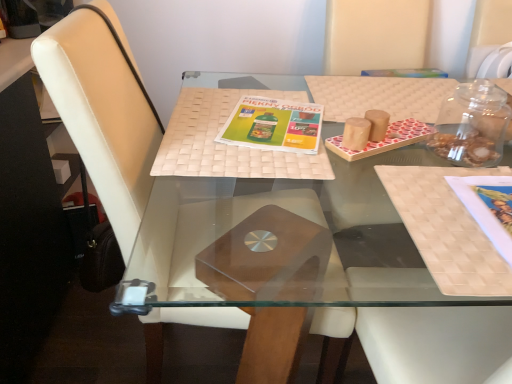
Question: Which direction should I rotate to face green matte magazine at center, arranged as the 2th book cover when ordered from the bottom, — up or down?

Choices:
 (A) down
 (B) up

Answer: (B)

Question: Does transparent glass jar at upper right come in front of matte paper book cover at right, placed as the 1th book cover when sorted from front to back?

Choices:
 (A) yes
 (B) no

Answer: (B)

Question: From a real-world perspective, is transparent glass jar at upper right on matte paper book cover at right, placed as the 1th book cover when sorted from front to back?

Choices:
 (A) no
 (B) yes

Answer: (B)

Question: From a real-world perspective, does transparent glass jar at upper right sit lower than matte paper book cover at right, acting as the second book cover starting from the back?

Choices:
 (A) yes
 (B) no

Answer: (B)

Question: Is matte paper book cover at right, placed as the 1th book cover when sorted from front to back, surrounded by transparent glass jar at upper right?

Choices:
 (A) no
 (B) yes

Answer: (A)

Question: Can you confirm if transparent glass jar at upper right is thinner than matte paper book cover at right, acting as the second book cover starting from the back?

Choices:
 (A) no
 (B) yes

Answer: (B)

Question: From the image's perspective, does transparent glass jar at upper right appear lower than matte paper book cover at right, which is the 1th book cover in right-to-left order?

Choices:
 (A) yes
 (B) no

Answer: (B)

Question: Does transparent glass jar at upper right come behind woven beige placemat at center?

Choices:
 (A) no
 (B) yes

Answer: (B)

Question: Is transparent glass jar at upper right looking in the opposite direction of woven beige placemat at center?

Choices:
 (A) yes
 (B) no

Answer: (B)

Question: From a real-world perspective, is transparent glass jar at upper right physically above woven beige placemat at center?

Choices:
 (A) yes
 (B) no

Answer: (A)

Question: Is transparent glass jar at upper right wider than woven beige placemat at center?

Choices:
 (A) yes
 (B) no

Answer: (B)

Question: Can you confirm if transparent glass jar at upper right is positioned to the right of woven beige placemat at center?

Choices:
 (A) yes
 (B) no

Answer: (A)

Question: Can you confirm if transparent glass jar at upper right is taller than woven beige placemat at center?

Choices:
 (A) no
 (B) yes

Answer: (B)

Question: From a real-world perspective, is woven beige placemat at center over green matte magazine at center, which is the 2th book cover in right-to-left order?

Choices:
 (A) yes
 (B) no

Answer: (A)